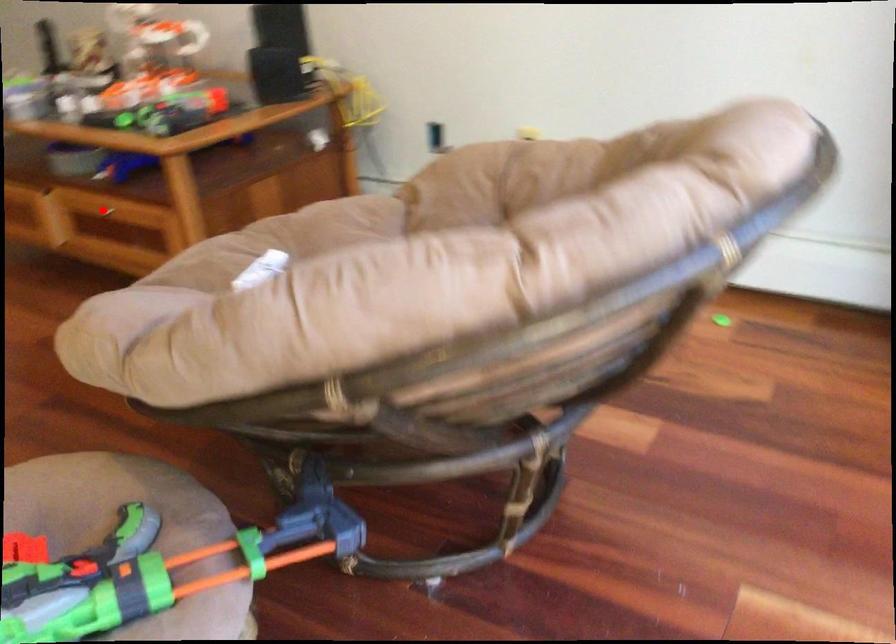
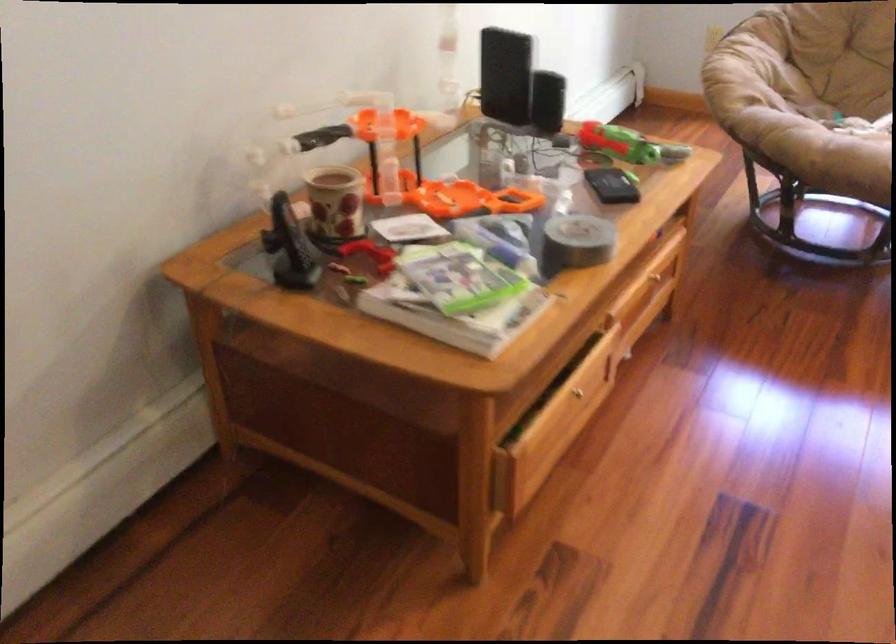
Where in the second image is the point corresponding to the highlighted location from the first image?

(653, 277)